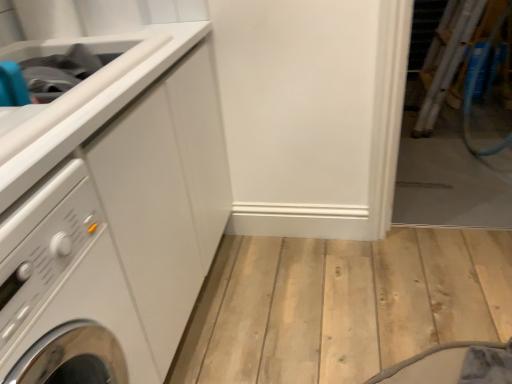
Question: Is white glossy washing machine at left not close to white glossy counter top at upper left?

Choices:
 (A) yes
 (B) no

Answer: (B)

Question: From a real-world perspective, is white glossy washing machine at left positioned over white glossy counter top at upper left based on gravity?

Choices:
 (A) yes
 (B) no

Answer: (B)

Question: Can you confirm if white glossy washing machine at left is thinner than white glossy counter top at upper left?

Choices:
 (A) yes
 (B) no

Answer: (B)

Question: Can white glossy counter top at upper left be found inside white glossy washing machine at left?

Choices:
 (A) no
 (B) yes

Answer: (A)

Question: Is white glossy washing machine at left positioned before white glossy counter top at upper left?

Choices:
 (A) no
 (B) yes

Answer: (B)

Question: Considering their positions, is matte white sink at upper left located in front of or behind white glossy counter top at upper left?

Choices:
 (A) front
 (B) behind

Answer: (B)

Question: Considering the positions of matte white sink at upper left and white glossy counter top at upper left in the image, is matte white sink at upper left wider or thinner than white glossy counter top at upper left?

Choices:
 (A) thin
 (B) wide

Answer: (A)

Question: Visually, is matte white sink at upper left positioned to the left or to the right of white glossy counter top at upper left?

Choices:
 (A) right
 (B) left

Answer: (B)

Question: Is matte white sink at upper left taller or shorter than white glossy counter top at upper left?

Choices:
 (A) tall
 (B) short

Answer: (B)

Question: Is point (26, 173) closer or farther from the camera than point (97, 59)?

Choices:
 (A) farther
 (B) closer

Answer: (B)

Question: Is white glossy counter top at upper left spatially inside matte white sink at upper left, or outside of it?

Choices:
 (A) inside
 (B) outside

Answer: (B)

Question: Considering the positions of white glossy counter top at upper left and matte white sink at upper left in the image, is white glossy counter top at upper left wider or thinner than matte white sink at upper left?

Choices:
 (A) wide
 (B) thin

Answer: (A)

Question: Relative to matte white sink at upper left, is white glossy counter top at upper left in front or behind?

Choices:
 (A) behind
 (B) front

Answer: (B)

Question: Does point (68, 221) appear closer or farther from the camera than point (78, 56)?

Choices:
 (A) closer
 (B) farther

Answer: (A)

Question: Would you say white glossy washing machine at left is to the left or to the right of matte white sink at upper left in the picture?

Choices:
 (A) left
 (B) right

Answer: (B)